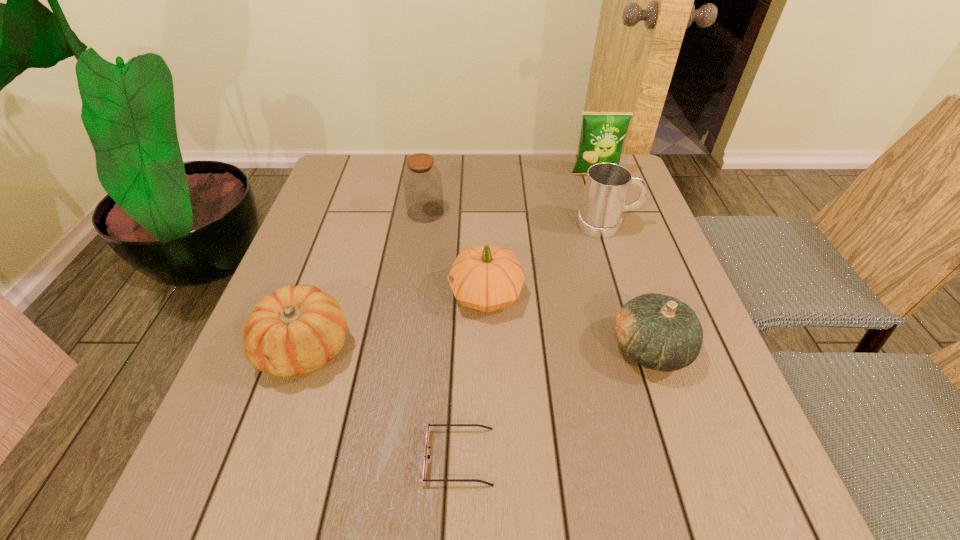
This screenshot has height=540, width=960. Find the location of `vacant space in between the mug and the nearest object`. vacant space in between the mug and the nearest object is located at coordinates coord(533,341).

You are a GUI agent. You are given a task and a screenshot of the screen. Output one action in this format:
    pyautogui.click(x=<x>, y=<y>)
    Task: Click on the free space between the mug and the shortest object
    Image resolution: width=960 pixels, height=540 pixels.
    Given the screenshot: What is the action you would take?
    pyautogui.click(x=533, y=341)

You are a GUI agent. You are given a task and a screenshot of the screen. Output one action in this format:
    pyautogui.click(x=<x>, y=<y>)
    Task: Click on the free space between the crisp (potato chip) and the jar
    The height and width of the screenshot is (540, 960).
    Given the screenshot: What is the action you would take?
    pyautogui.click(x=510, y=193)

Locate an element on the screen. The image size is (960, 540). free point between the nearest object and the tallest object is located at coordinates (526, 315).

Where is `free area in between the sunglasses and the second gourd from right to left`? The image size is (960, 540). free area in between the sunglasses and the second gourd from right to left is located at coordinates (472, 375).

You are a GUI agent. You are given a task and a screenshot of the screen. Output one action in this format:
    pyautogui.click(x=<x>, y=<y>)
    Task: Click on the unoccupied area between the sunglasses and the jar
    Image resolution: width=960 pixels, height=540 pixels.
    Given the screenshot: What is the action you would take?
    pyautogui.click(x=442, y=334)

Identify the location of vacant region between the leftmost gourd and the second gourd from right to left. (396, 321).

You are a GUI agent. You are given a task and a screenshot of the screen. Output one action in this format:
    pyautogui.click(x=<x>, y=<y>)
    Task: Click on the empty space between the second gourd from right to left and the leftmost object
    
    Given the screenshot: What is the action you would take?
    pyautogui.click(x=396, y=321)

Identify which object is the fourth nearest to the farthest object. Please provide its 2D coordinates. Your answer should be formatted as a tuple, i.e. [(x, y)], where the tuple contains the x and y coordinates of a point satisfying the conditions above.

[(659, 332)]

This screenshot has height=540, width=960. In order to click on object that stands as the sixth closest to the sixth object from right to left in this screenshot , I will do `click(424, 479)`.